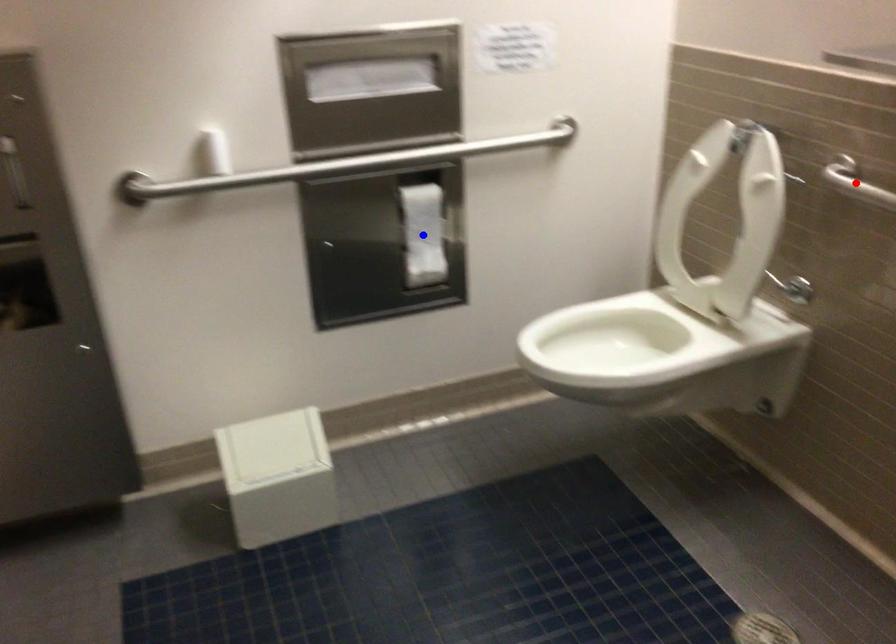
Question: Two points are marked on the image. Which point is closer to the camera?

Choices:
 (A) Blue point is closer.
 (B) Red point is closer.

Answer: (B)